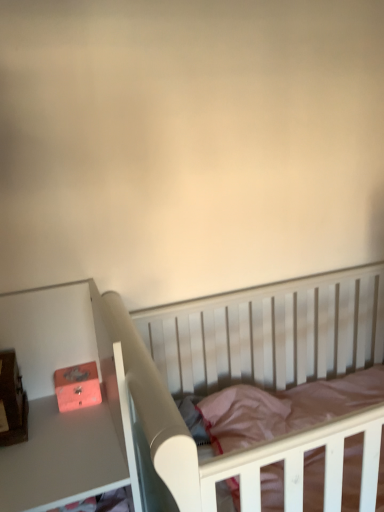
Question: Is white wood crib at center not inside matte orange box at left?

Choices:
 (A) yes
 (B) no

Answer: (A)

Question: Can you confirm if white wood crib at center is bigger than matte orange box at left?

Choices:
 (A) yes
 (B) no

Answer: (A)

Question: Considering the relative positions of white wood crib at center and matte orange box at left in the image provided, is white wood crib at center to the right of matte orange box at left from the viewer's perspective?

Choices:
 (A) no
 (B) yes

Answer: (B)

Question: Is white wood crib at center facing away from matte orange box at left?

Choices:
 (A) no
 (B) yes

Answer: (A)

Question: Is the position of white wood crib at center more distant than that of matte orange box at left?

Choices:
 (A) no
 (B) yes

Answer: (A)

Question: Does white wood crib at center turn towards matte orange box at left?

Choices:
 (A) no
 (B) yes

Answer: (A)

Question: Is white wood crib at center turned away from matte pink drawer at left?

Choices:
 (A) no
 (B) yes

Answer: (A)

Question: Does white wood crib at center have a lesser width compared to matte pink drawer at left?

Choices:
 (A) yes
 (B) no

Answer: (B)

Question: From the image's perspective, does white wood crib at center appear lower than matte pink drawer at left?

Choices:
 (A) no
 (B) yes

Answer: (A)

Question: Would you say matte pink drawer at left is part of white wood crib at center's contents?

Choices:
 (A) no
 (B) yes

Answer: (A)

Question: From a real-world perspective, is white wood crib at center physically above matte pink drawer at left?

Choices:
 (A) no
 (B) yes

Answer: (A)

Question: Can you confirm if white wood crib at center is smaller than matte pink drawer at left?

Choices:
 (A) yes
 (B) no

Answer: (B)

Question: Is matte pink drawer at left oriented away from matte orange box at left?

Choices:
 (A) no
 (B) yes

Answer: (B)